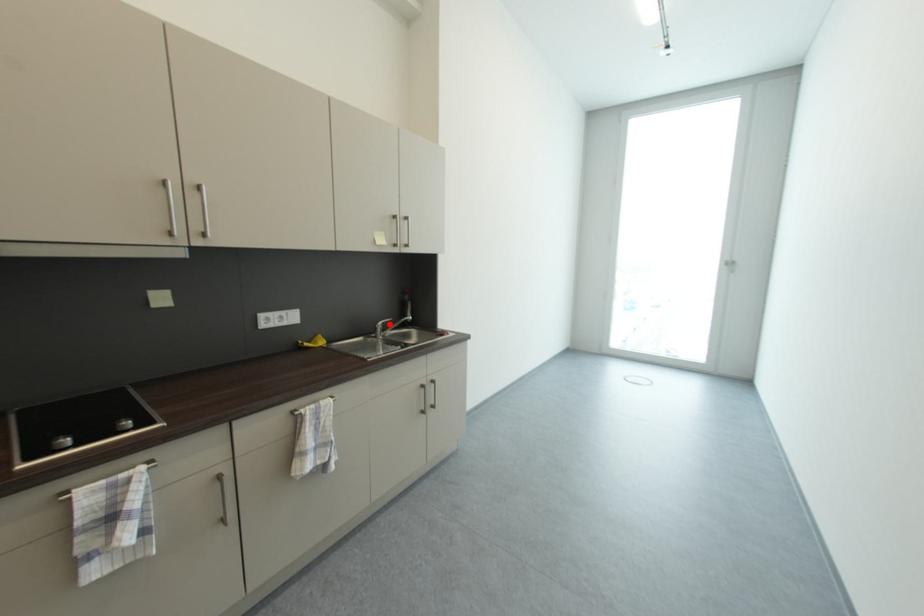
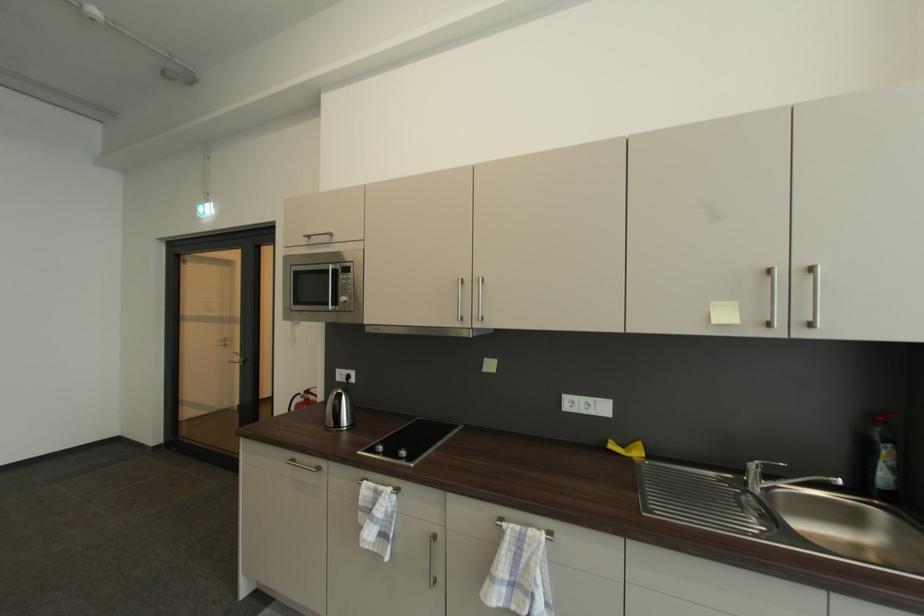
Where in the second image is the point corresponding to the highlighted location from the first image?

(769, 466)